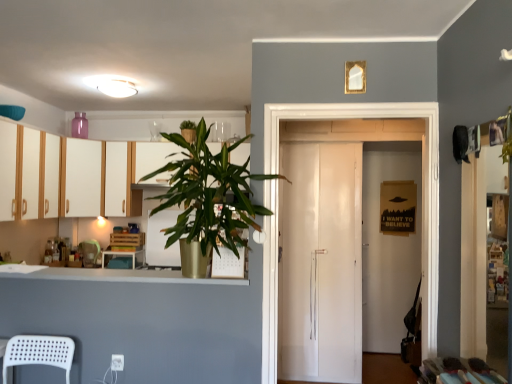
The image size is (512, 384). What do you see at coordinates (208, 200) in the screenshot?
I see `green leafy plant at upper center` at bounding box center [208, 200].

What is the approximate width of matte wood table at center?

matte wood table at center is 11.50 inches in width.

What do you see at coordinates (71, 174) in the screenshot?
I see `white wood cabinets at left, the first cabinetry positioned from the right` at bounding box center [71, 174].

In order to click on white glossy door at center in this screenshot , I will do `click(423, 177)`.

Is matte wood table at center completely or partially inside white wood cabinets at left, the first cabinetry positioned from the right?

That's incorrect, matte wood table at center is not inside white wood cabinets at left, the first cabinetry positioned from the right.

Does point (42, 184) come behind point (103, 262)?

No, (42, 184) is in front of (103, 262).

Is white wood cabinets at left, which is the second cabinetry from left to right, shorter than matte wood table at center?

Incorrect, the height of white wood cabinets at left, which is the second cabinetry from left to right, does not fall short of that of matte wood table at center.

Considering the sizes of objects white wood cabinets at left, acting as the 2th cabinetry starting from the back, and matte wood table at center in the image provided, who is wider, white wood cabinets at left, acting as the 2th cabinetry starting from the back, or matte wood table at center?

Wider between the two is white wood cabinets at left, acting as the 2th cabinetry starting from the back.

In terms of height, does white wood cabinets at left, the first cabinetry positioned from the right, look taller or shorter compared to white glossy refrigerator at center?

Considering their sizes, white wood cabinets at left, the first cabinetry positioned from the right, has more height than white glossy refrigerator at center.

Image resolution: width=512 pixels, height=384 pixels. I want to click on the 2nd cabinetry positioned above the white glossy refrigerator at center (from a real-world perspective), so click(x=71, y=174).

In the image, is white wood cabinets at left, the first cabinetry positioned from the right, positioned in front of or behind white glossy refrigerator at center?

white wood cabinets at left, the first cabinetry positioned from the right, is in front of white glossy refrigerator at center.

From a real-world perspective, who is located lower, white wood cabinets at left, the first cabinetry positioned from the right, or white glossy refrigerator at center?

In real-world perspective, white glossy refrigerator at center is lower.

From a real-world perspective, who is located lower, matte white cabinet at upper left, the first cabinetry viewed from the back, or green leafy plant at upper center?

green leafy plant at upper center is physically lower.

In the scene shown: Considering the sizes of matte white cabinet at upper left, the first cabinetry viewed from the back, and green leafy plant at upper center in the image, is matte white cabinet at upper left, the first cabinetry viewed from the back, taller or shorter than green leafy plant at upper center?

matte white cabinet at upper left, the first cabinetry viewed from the back, is shorter than green leafy plant at upper center.

Is matte white cabinet at upper left, which ranks as the first cabinetry in left-to-right order, turned away from green leafy plant at upper center?

No.

Looking at this image, considering the positions of objects matte white cabinet at upper left, the second cabinetry from the right, and green leafy plant at upper center in the image provided, who is more to the right, matte white cabinet at upper left, the second cabinetry from the right, or green leafy plant at upper center?

Positioned to the right is green leafy plant at upper center.

Can you confirm if white glossy door at center is bigger than green leafy plant at upper center?

Yes.

Which object is further away from the camera taking this photo, white glossy door at center or green leafy plant at upper center?

white glossy door at center is further away from the camera.

From the image's perspective, is white glossy door at center on top of green leafy plant at upper center?

No, from the image's perspective, white glossy door at center is not over green leafy plant at upper center.

Image resolution: width=512 pixels, height=384 pixels. In order to click on table located below the matte white cabinet at upper left, the second cabinetry when ordered from front to back (from the image's perspective) in this screenshot , I will do `click(122, 259)`.

Is matte white cabinet at upper left, the first cabinetry viewed from the back, touching matte wood table at center?

matte white cabinet at upper left, the first cabinetry viewed from the back, is not next to matte wood table at center, and they're not touching.

Does matte white cabinet at upper left, which ranks as the first cabinetry in left-to-right order, have a greater height compared to matte wood table at center?

Yes.

From the image's perspective, who appears lower, matte white cabinet at upper left, the first cabinetry viewed from the back, or matte wood table at center?

matte wood table at center.

This screenshot has width=512, height=384. I want to click on table that appears in front of the matte white cabinet at upper left, the second cabinetry from the right, so click(122, 259).

Are matte wood table at center and matte white cabinet at upper left, the second cabinetry from the right, located far from each other?

No.

From the image's perspective, is matte wood table at center below matte white cabinet at upper left, the second cabinetry from the right?

Yes.

From a real-world perspective, is white wood cabinets at left, acting as the first cabinetry starting from the front, located beneath white plastic chair at lower left?

No, from a real-world perspective, white wood cabinets at left, acting as the first cabinetry starting from the front, is not under white plastic chair at lower left.

Could you measure the distance between white wood cabinets at left, the first cabinetry positioned from the right, and white plastic chair at lower left?

white wood cabinets at left, the first cabinetry positioned from the right, is 1.62 meters from white plastic chair at lower left.

Can we say white wood cabinets at left, acting as the first cabinetry starting from the front, lies outside white plastic chair at lower left?

Yes, white wood cabinets at left, acting as the first cabinetry starting from the front, is outside of white plastic chair at lower left.

Which of these two, white wood cabinets at left, acting as the first cabinetry starting from the front, or white plastic chair at lower left, is wider?

With larger width is white wood cabinets at left, acting as the first cabinetry starting from the front.

You are a GUI agent. You are given a task and a screenshot of the screen. Output one action in this format:
    pyautogui.click(x=<x>, y=<y>)
    Task: Click on the table behind the white wood cabinets at left, the first cabinetry positioned from the right
    
    Given the screenshot: What is the action you would take?
    pyautogui.click(x=122, y=259)

I want to click on appliance on the right of white wood cabinets at left, which is the second cabinetry from left to right, so click(161, 240).

From the image, which object appears to be nearer to matte wood table at center, green leafy plant at upper center or white glossy refrigerator at center?

Based on the image, white glossy refrigerator at center appears to be nearer to matte wood table at center.

Looking at this image, estimate the real-world distances between objects in this image. Which object is closer to matte white cabinet at upper left, which ranks as the first cabinetry in left-to-right order, matte wood table at center or white wood cabinets at left, the first cabinetry positioned from the right?

Based on the image, white wood cabinets at left, the first cabinetry positioned from the right, appears to be nearer to matte white cabinet at upper left, which ranks as the first cabinetry in left-to-right order.

Considering their positions, is green leafy plant at upper center positioned further to white glossy door at center than matte wood table at center?

matte wood table at center.

Which object lies further to the anchor point white glossy door at center, white plastic chair at lower left or matte wood table at center?

Based on the image, matte wood table at center appears to be further to white glossy door at center.

From the image, which object appears to be nearer to white glossy door at center, matte white cabinet at upper left, the second cabinetry from the right, or white glossy refrigerator at center?

Based on the image, white glossy refrigerator at center appears to be nearer to white glossy door at center.

Looking at the image, which one is located closer to white wood cabinets at left, acting as the 2th cabinetry starting from the back, white plastic chair at lower left or matte wood table at center?

The object closer to white wood cabinets at left, acting as the 2th cabinetry starting from the back, is matte wood table at center.

From the image, which object appears to be nearer to white plastic chair at lower left, white wood cabinets at left, acting as the 2th cabinetry starting from the back, or matte wood table at center?

white wood cabinets at left, acting as the 2th cabinetry starting from the back.

Considering their positions, is green leafy plant at upper center positioned closer to matte wood table at center than matte white cabinet at upper left, the second cabinetry when ordered from front to back?

Based on the image, matte white cabinet at upper left, the second cabinetry when ordered from front to back, appears to be nearer to matte wood table at center.

Where is `cabinetry between white wood cabinets at left, acting as the 2th cabinetry starting from the back, and white glossy refrigerator at center from front to back`? This screenshot has height=384, width=512. cabinetry between white wood cabinets at left, acting as the 2th cabinetry starting from the back, and white glossy refrigerator at center from front to back is located at coordinates (118, 179).

I want to click on table between white wood cabinets at left, which is the second cabinetry from left to right, and matte white cabinet at upper left, the second cabinetry when ordered from front to back, along the z-axis, so tap(122, 259).

Image resolution: width=512 pixels, height=384 pixels. I want to click on houseplant between white plastic chair at lower left and matte white cabinet at upper left, the second cabinetry when ordered from front to back, in the front-back direction, so click(x=208, y=200).

Where is `appliance located between white plastic chair at lower left and white glossy door at center in the left-right direction`? appliance located between white plastic chair at lower left and white glossy door at center in the left-right direction is located at coordinates (161, 240).